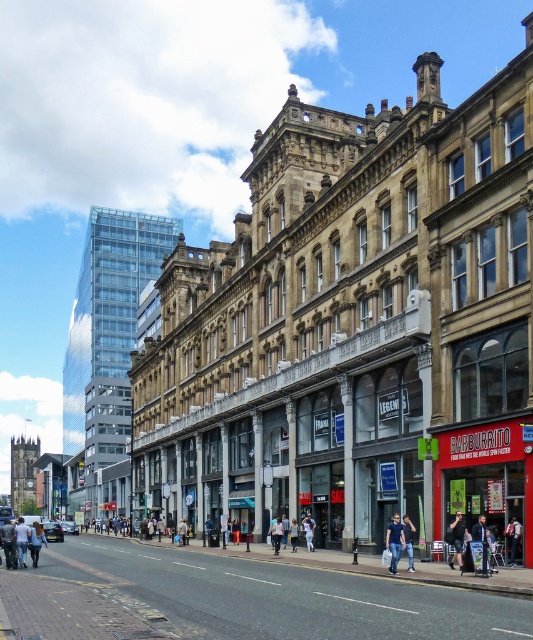
You are a photographer standing on the street in front of the historic building. You notice a black fabric person at center and a denim pants at lower left. Which of these two objects is taller?

The denim pants at lower left is taller than the black fabric person at center.

You are a photographer standing in the middle of the street. You notice a dark blue jeans at center and a black fabric person at center in your frame. Which object appears taller in the photo?

The dark blue jeans at center appears taller than the black fabric person at center in the photo.

You are a tourist standing on the street and want to take a photo of the red brick building at lower right without including the black fabric person at center in the frame. Which direction should you move to achieve this?

The red brick building at lower right is to the right of the black fabric person at center. To exclude the black fabric person at center from the photo, you should move to the right side of the black fabric person at center so that the red brick building at lower right remains in view while the person is no longer in the frame.